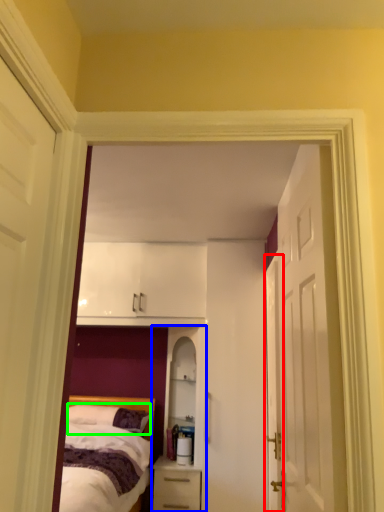
Question: Estimate the real-world distances between objects in this image. Which object is farther from door (highlighted by a red box), dresser (highlighted by a blue box) or pillow (highlighted by a green box)?

Choices:
 (A) dresser
 (B) pillow

Answer: (B)